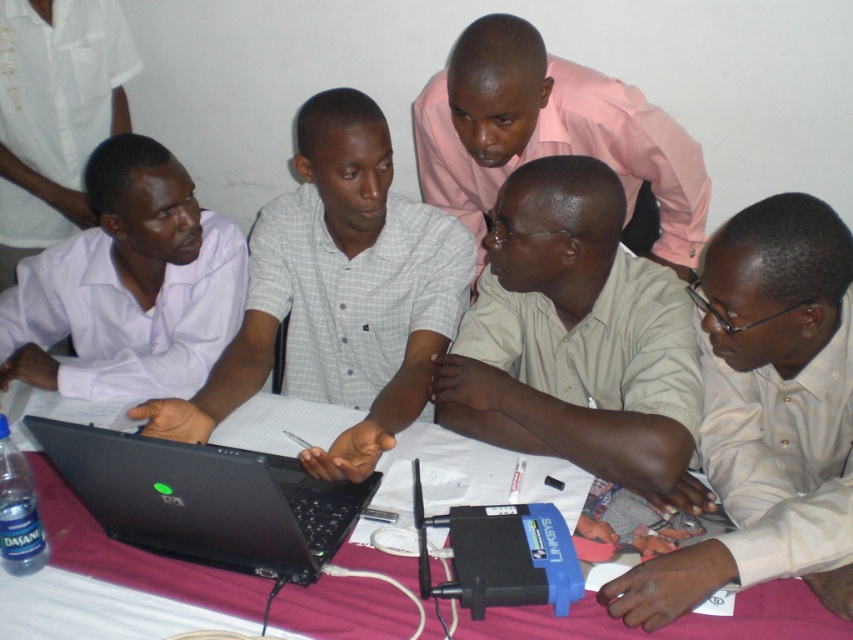
Question: Which point appears closest to the camera in this image?

Choices:
 (A) (51, 493)
 (B) (663, 234)
 (C) (73, 131)
 (D) (96, 506)

Answer: (D)

Question: Is beige shirt at lower right to the right of pink smooth shirt at upper center from the viewer's perspective?

Choices:
 (A) no
 (B) yes

Answer: (B)

Question: Among these objects, which one is nearest to the camera?

Choices:
 (A) matte white shirt at left
 (B) beige shirt at center

Answer: (B)

Question: Is matte white shirt at left wider than pink smooth shirt at upper center?

Choices:
 (A) yes
 (B) no

Answer: (B)

Question: Which point is closer to the camera taking this photo?

Choices:
 (A) (56, 157)
 (B) (361, 436)
 (C) (96, 180)

Answer: (B)

Question: Considering the relative positions of beige shirt at lower right and purple fabric table at center in the image provided, where is beige shirt at lower right located with respect to purple fabric table at center?

Choices:
 (A) left
 (B) right

Answer: (B)